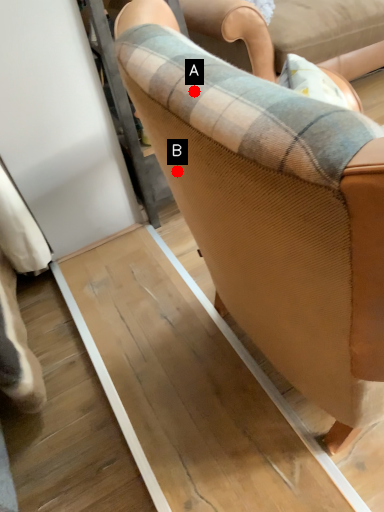
Question: Two points are circled on the image, labeled by A and B beside each circle. Which point is closer to the camera?

Choices:
 (A) A is closer
 (B) B is closer

Answer: (A)